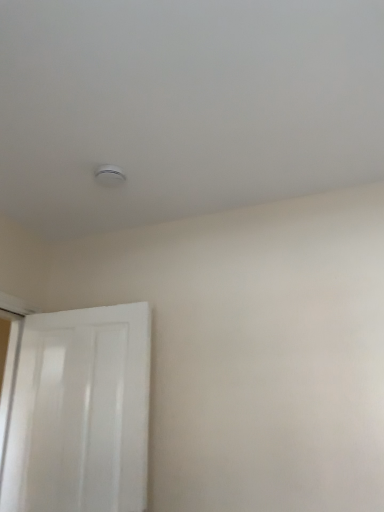
In order to face white glossy door at lower left, should I rotate leftwards or rightwards?

Rotate your view left by about 15.044°.

This screenshot has height=512, width=384. What do you see at coordinates (80, 412) in the screenshot? I see `white glossy door at lower left` at bounding box center [80, 412].

I want to click on white glossy door at lower left, so click(x=80, y=412).

The height and width of the screenshot is (512, 384). I want to click on white glossy door at lower left, so click(80, 412).